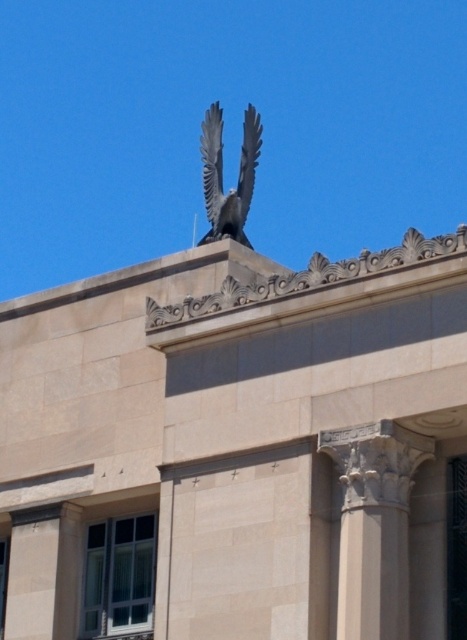
Question: Which point is farther to the camera?

Choices:
 (A) (391, 573)
 (B) (243, 236)

Answer: (B)

Question: Which point appears closest to the camera in this image?

Choices:
 (A) (396, 497)
 (B) (248, 154)

Answer: (A)

Question: Does gray stone column at center come in front of polished bronze eagle at upper center?

Choices:
 (A) no
 (B) yes

Answer: (B)

Question: Is gray stone column at center bigger than polished bronze eagle at upper center?

Choices:
 (A) no
 (B) yes

Answer: (A)

Question: Is gray stone column at center smaller than polished bronze eagle at upper center?

Choices:
 (A) yes
 (B) no

Answer: (A)

Question: Which object is closer to the camera taking this photo?

Choices:
 (A) gray stone column at center
 (B) polished bronze eagle at upper center

Answer: (A)